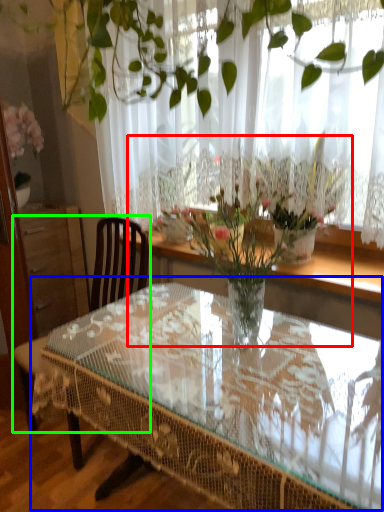
Question: Which object is positioned farthest from floral arrangement (highlighted by a red box)? Select from coffee table (highlighted by a blue box) and chair (highlighted by a green box).

Choices:
 (A) coffee table
 (B) chair

Answer: (B)